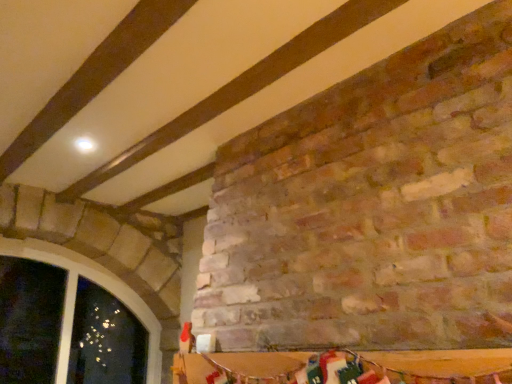
Question: Considering the relative sizes of wooden table at lower center and matte stone window at lower left in the image provided, is wooden table at lower center smaller than matte stone window at lower left?

Choices:
 (A) yes
 (B) no

Answer: (A)

Question: Is wooden table at lower center turned away from matte stone window at lower left?

Choices:
 (A) yes
 (B) no

Answer: (B)

Question: From the image's perspective, is wooden table at lower center under matte stone window at lower left?

Choices:
 (A) no
 (B) yes

Answer: (A)

Question: Is wooden table at lower center far away from matte stone window at lower left?

Choices:
 (A) yes
 (B) no

Answer: (A)

Question: Considering the relative sizes of wooden table at lower center and matte stone window at lower left in the image provided, is wooden table at lower center shorter than matte stone window at lower left?

Choices:
 (A) yes
 (B) no

Answer: (A)

Question: From a real-world perspective, is wooden table at lower center positioned under matte stone window at lower left based on gravity?

Choices:
 (A) no
 (B) yes

Answer: (B)

Question: Does matte stone window at lower left turn towards wooden table at lower center?

Choices:
 (A) yes
 (B) no

Answer: (A)

Question: From the image's perspective, is matte stone window at lower left on wooden table at lower center?

Choices:
 (A) yes
 (B) no

Answer: (B)

Question: Can you confirm if matte stone window at lower left is shorter than wooden table at lower center?

Choices:
 (A) yes
 (B) no

Answer: (B)

Question: Is matte stone window at lower left in front of wooden table at lower center?

Choices:
 (A) yes
 (B) no

Answer: (B)

Question: From a real-world perspective, does matte stone window at lower left sit lower than wooden table at lower center?

Choices:
 (A) yes
 (B) no

Answer: (B)

Question: Is matte stone window at lower left positioned behind wooden table at lower center?

Choices:
 (A) no
 (B) yes

Answer: (B)

Question: From the image's perspective, is matte stone window at lower left located above or below wooden table at lower center?

Choices:
 (A) above
 (B) below

Answer: (B)